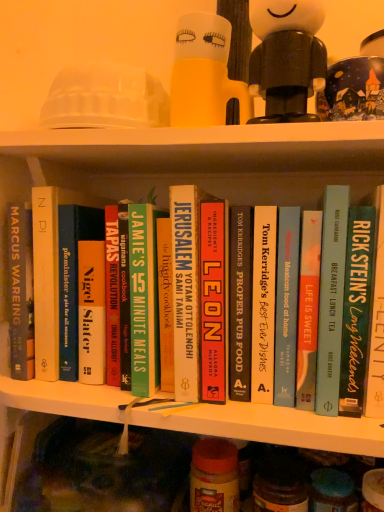
Question: Is black hardcover book at center, marked as the 4th book in a right-to-left arrangement, positioned beyond the bounds of hardcover cookbook at center, acting as the sixth book starting from the right?

Choices:
 (A) yes
 (B) no

Answer: (A)

Question: Is black hardcover book at center, which is counted as the 5th book, starting from the left, positioned behind hardcover cookbook at center, which is the third book in left-to-right order?

Choices:
 (A) no
 (B) yes

Answer: (B)

Question: Does black hardcover book at center, which is counted as the 5th book, starting from the left, have a greater height compared to hardcover cookbook at center, acting as the sixth book starting from the right?

Choices:
 (A) yes
 (B) no

Answer: (B)

Question: Is black hardcover book at center, which is counted as the 5th book, starting from the left, surrounding hardcover cookbook at center, acting as the sixth book starting from the right?

Choices:
 (A) yes
 (B) no

Answer: (B)

Question: Does black hardcover book at center, marked as the 4th book in a right-to-left arrangement, have a lesser width compared to hardcover cookbook at center, acting as the sixth book starting from the right?

Choices:
 (A) no
 (B) yes

Answer: (B)

Question: Can you confirm if black hardcover book at center, which is counted as the 5th book, starting from the left, is positioned to the left of hardcover cookbook at center, acting as the sixth book starting from the right?

Choices:
 (A) no
 (B) yes

Answer: (A)

Question: Is translucent plastic jar at center, which is the 1th glass jar from left to right, shorter than white matte figurine at upper center?

Choices:
 (A) yes
 (B) no

Answer: (A)

Question: Does translucent plastic jar at center, arranged as the second glass jar when viewed from the right, have a larger size compared to white matte figurine at upper center?

Choices:
 (A) no
 (B) yes

Answer: (A)

Question: Considering the relative positions of translucent plastic jar at center, which is the 1th glass jar from left to right, and white matte figurine at upper center in the image provided, is translucent plastic jar at center, which is the 1th glass jar from left to right, in front of white matte figurine at upper center?

Choices:
 (A) yes
 (B) no

Answer: (B)

Question: Considering the relative sizes of translucent plastic jar at center, arranged as the second glass jar when viewed from the right, and white matte figurine at upper center in the image provided, is translucent plastic jar at center, arranged as the second glass jar when viewed from the right, taller than white matte figurine at upper center?

Choices:
 (A) no
 (B) yes

Answer: (A)

Question: Would you say translucent plastic jar at center, which is the 1th glass jar from left to right, contains white matte figurine at upper center?

Choices:
 (A) yes
 (B) no

Answer: (B)

Question: Does translucent plastic jar at center, which is the 1th glass jar from left to right, have a greater width compared to white matte figurine at upper center?

Choices:
 (A) no
 (B) yes

Answer: (A)

Question: Can you confirm if hardcover book at center, which is counted as the 5th book, starting from the right, is smaller than translucent yellow cup at upper center?

Choices:
 (A) yes
 (B) no

Answer: (B)